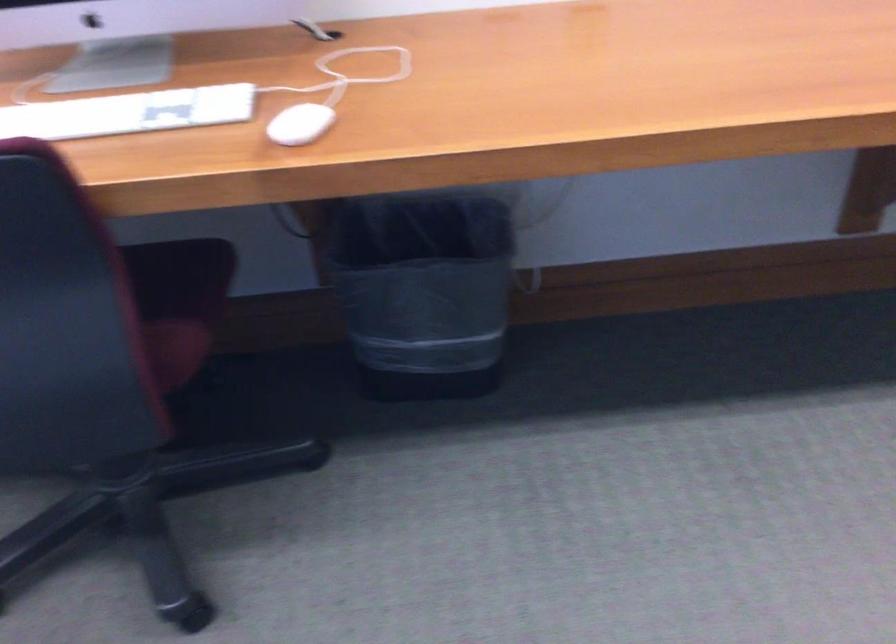
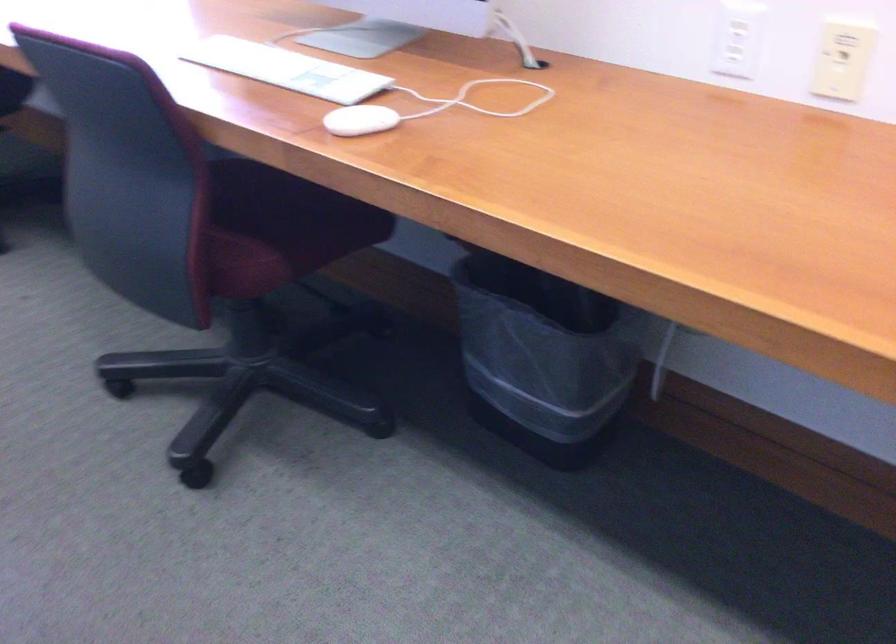
Question: The camera is either moving clockwise (left) or counter-clockwise (right) around the object. The first image is from the beginning of the video and the second image is from the end. Is the camera moving left or right when shooting the video?

Choices:
 (A) Left
 (B) Right

Answer: (B)